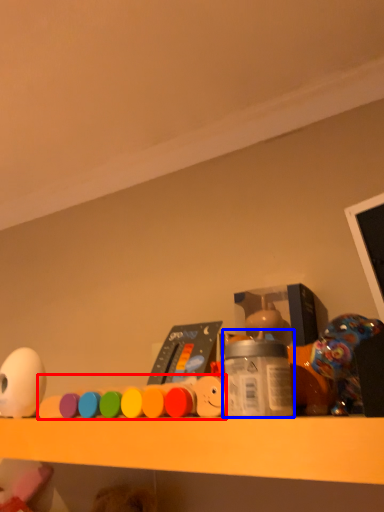
Question: Which object appears closest to the camera in this image, toy (highlighted by a red box) or bottle (highlighted by a blue box)?

Choices:
 (A) toy
 (B) bottle

Answer: (B)